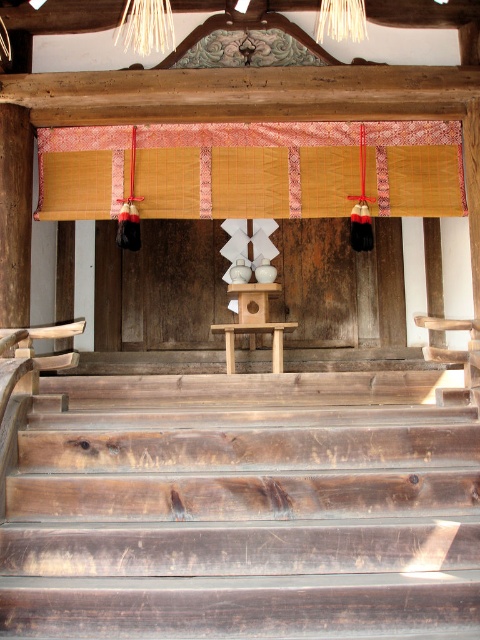
Question: Does dark brown wood stairs at center have a larger size compared to bamboo mat at upper center?

Choices:
 (A) no
 (B) yes

Answer: (B)

Question: Is dark brown wood stairs at center wider than bamboo mat at upper center?

Choices:
 (A) no
 (B) yes

Answer: (A)

Question: Which point appears closest to the camera in this image?

Choices:
 (A) (367, 150)
 (B) (433, 616)

Answer: (B)

Question: Which object appears closest to the camera in this image?

Choices:
 (A) bamboo mat at upper center
 (B) dark brown wood stairs at center

Answer: (B)

Question: Does dark brown wood stairs at center have a larger size compared to bamboo mat at upper center?

Choices:
 (A) no
 (B) yes

Answer: (B)